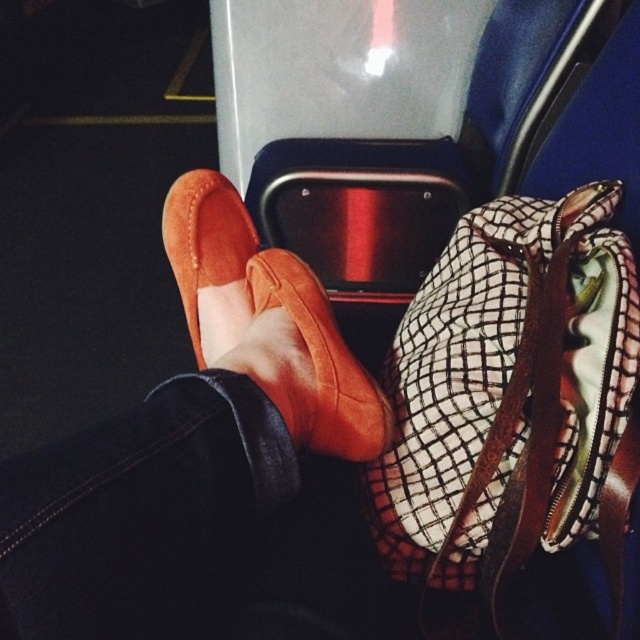
Question: Estimate the real-world distances between objects in this image. Which object is farther from the suede orange loafers at center?

Choices:
 (A) plaid fabric bag at center
 (B) suede orange slip-on shoe at center
 (C) suede orange shoe at center

Answer: (A)

Question: From the image, what is the correct spatial relationship of suede orange loafers at center in relation to suede orange shoe at center?

Choices:
 (A) below
 (B) above

Answer: (A)

Question: Can you confirm if suede orange loafers at center is smaller than suede orange shoe at center?

Choices:
 (A) no
 (B) yes

Answer: (A)

Question: Can you confirm if plaid fabric bag at center is wider than suede orange shoe at center?

Choices:
 (A) yes
 (B) no

Answer: (A)

Question: Which of the following is the closest to the observer?

Choices:
 (A) (220, 209)
 (B) (51, 611)
 (C) (321, 349)
 (D) (541, 388)

Answer: (B)

Question: Based on their relative distances, which object is farther from the suede orange shoe at center?

Choices:
 (A) suede orange slip-on shoe at center
 (B) plaid fabric bag at center

Answer: (B)